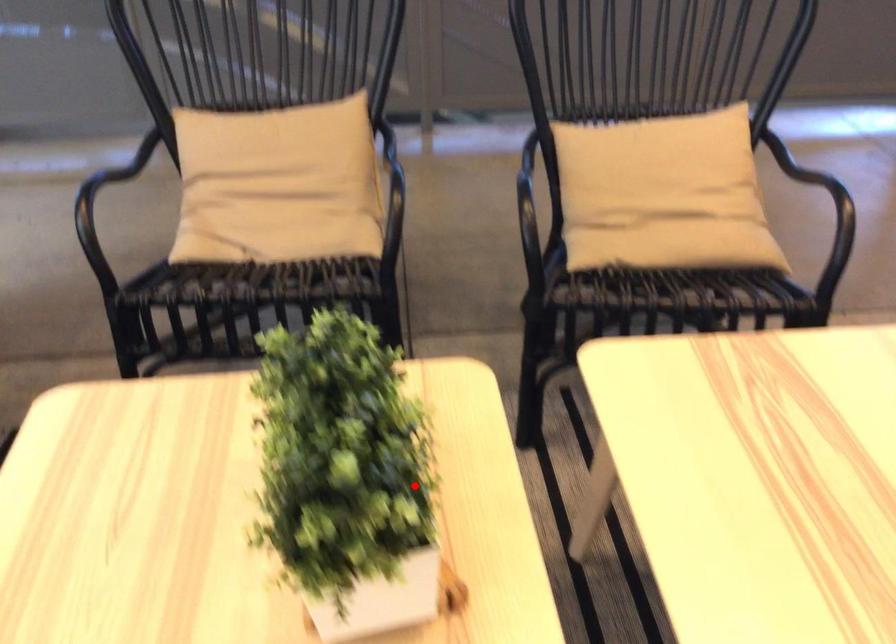
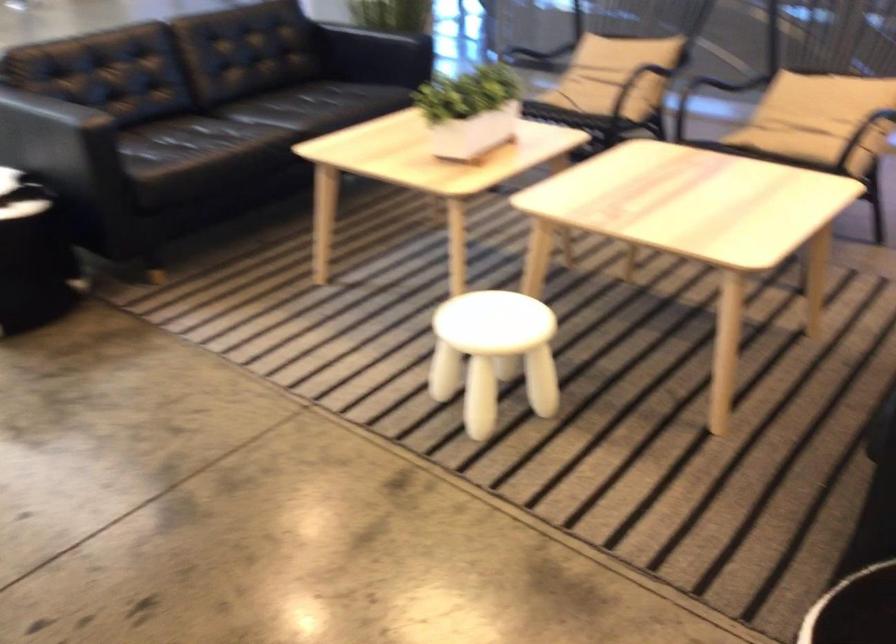
Locate, in the second image, the point that corresponds to the highlighted location in the first image.

(470, 111)